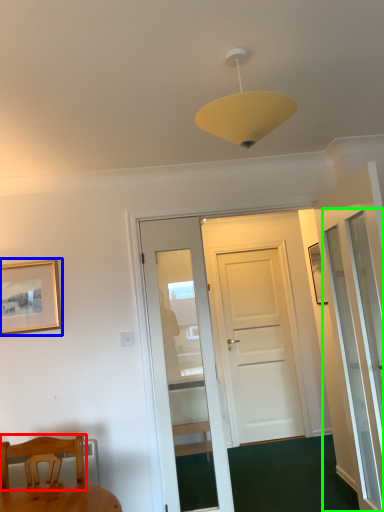
Question: Which object is positioned farthest from chair (highlighted by a red box)? Select from picture frame (highlighted by a blue box) and screen door (highlighted by a green box).

Choices:
 (A) picture frame
 (B) screen door

Answer: (B)